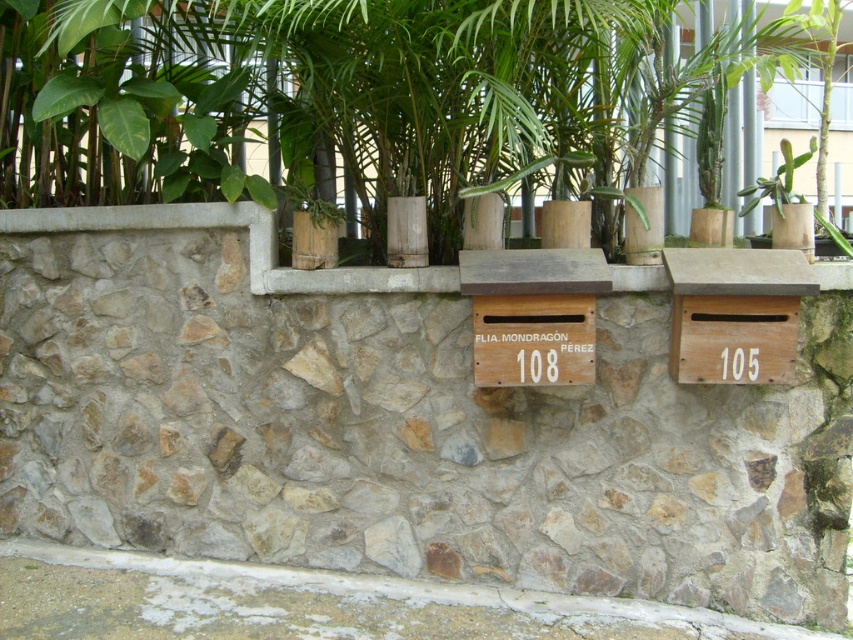
Question: Which of these objects is positioned closest to the smooth concrete ledge at center?

Choices:
 (A) natural stone mailbox at center
 (B) green succulent at center
 (C) white stone ledge at lower center
 (D) green leafy plant at upper center

Answer: (A)

Question: Among these objects, which one is nearest to the camera?

Choices:
 (A) white stone ledge at lower center
 (B) green succulent at center
 (C) green leafy plant at upper center

Answer: (C)

Question: Does white stone ledge at lower center come behind smooth concrete ledge at center?

Choices:
 (A) no
 (B) yes

Answer: (A)

Question: Observing the image, what is the correct spatial positioning of green leafy plant at upper center in reference to green succulent at center?

Choices:
 (A) below
 (B) above

Answer: (B)

Question: Is white stone ledge at lower center in front of green succulent at center?

Choices:
 (A) yes
 (B) no

Answer: (A)

Question: Which object is positioned closest to the white stone ledge at lower center?

Choices:
 (A) green succulent at center
 (B) natural stone mailbox at center
 (C) green leafy plant at upper center
 (D) smooth concrete ledge at center

Answer: (B)